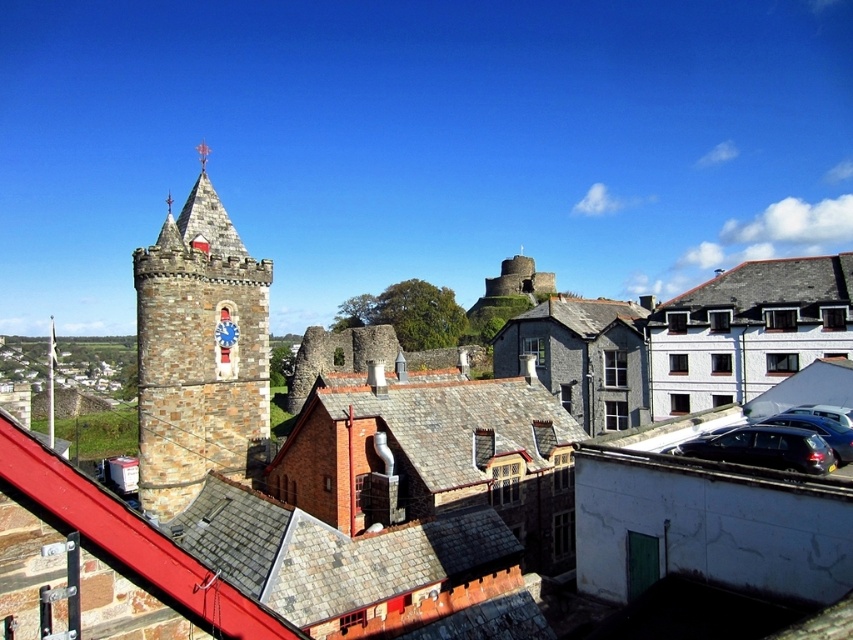
Between gray slate roof at upper right and shiny black sedan at lower right, which one is positioned higher?

gray slate roof at upper right is higher up.

Does gray slate roof at upper right have a greater width compared to shiny black sedan at lower right?

Indeed, gray slate roof at upper right has a greater width compared to shiny black sedan at lower right.

Find the location of a particular element. This screenshot has height=640, width=853. gray slate roof at upper right is located at coordinates (764, 291).

Image resolution: width=853 pixels, height=640 pixels. What are the coordinates of `gray slate roof at upper right` in the screenshot? It's located at (764, 291).

Can you confirm if shiny black sedan at lower right is bigger than shiny black car at lower right?

Yes, shiny black sedan at lower right is bigger than shiny black car at lower right.

Is point (689, 449) closer to camera compared to point (839, 433)?

No, (689, 449) is further to viewer.

The image size is (853, 640). I want to click on shiny black sedan at lower right, so click(763, 448).

Is stone clock tower at left in front of shiny black car at lower right?

No.

In the scene shown: Between stone clock tower at left and shiny black car at lower right, which one is positioned lower?

shiny black car at lower right is lower down.

Is point (167, 509) positioned in front of point (787, 417)?

That is False.

Locate an element on the screen. This screenshot has width=853, height=640. stone clock tower at left is located at coordinates 198,352.